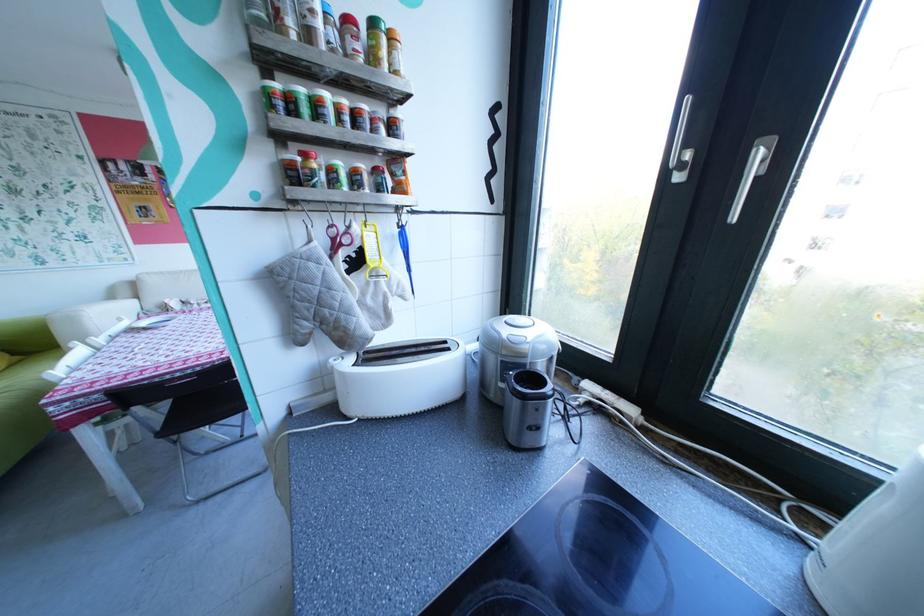
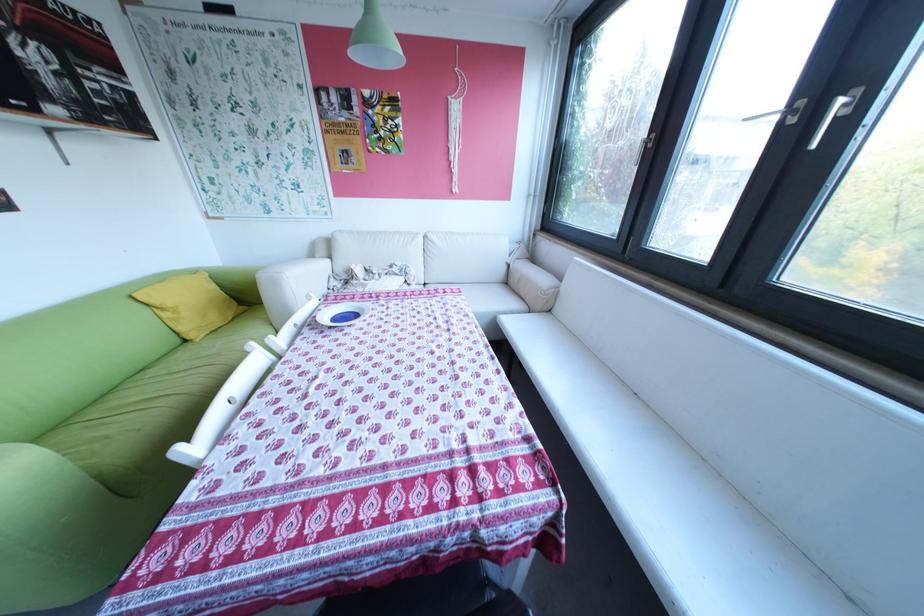
Locate, in the second image, the point that corresponds to [87,320] in the first image.

(288, 283)